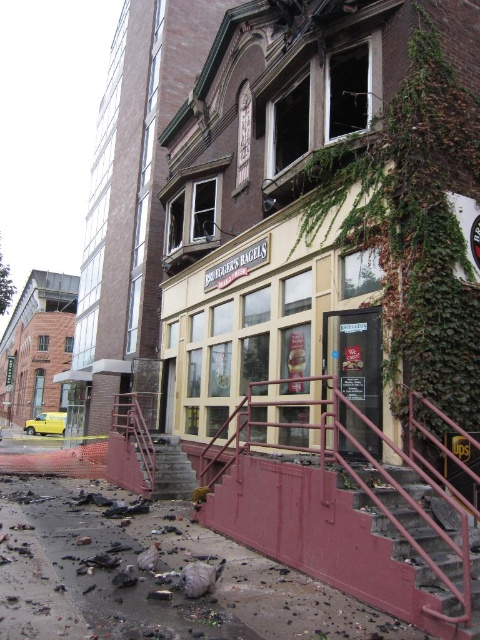
Is metallic red handrail at center shorter than rusty metal stairs at lower right?

In fact, metallic red handrail at center may be taller than rusty metal stairs at lower right.

Can you confirm if metallic red handrail at center is positioned to the right of rusty metal stairs at lower right?

No, metallic red handrail at center is not to the right of rusty metal stairs at lower right.

Locate an element on the screen. This screenshot has height=640, width=480. metallic red handrail at center is located at coordinates (350, 515).

Does metallic red handrail at center appear on the left side of concrete stairs at lower center?

In fact, metallic red handrail at center is to the right of concrete stairs at lower center.

Can you confirm if metallic red handrail at center is positioned above concrete stairs at lower center?

Indeed, metallic red handrail at center is positioned over concrete stairs at lower center.

Measure the distance between metallic red handrail at center and camera.

4.86 meters

This screenshot has width=480, height=640. Identify the location of metallic red handrail at center. (350, 515).

Between green ivy at upper right and rusty metal stairs at lower right, which one has more height?

With more height is green ivy at upper right.

Which is behind, point (360, 156) or point (432, 493)?

The point (360, 156) is behind.

Does point (420, 342) come closer to viewer compared to point (398, 508)?

No, (420, 342) is further to viewer.

I want to click on green ivy at upper right, so click(x=414, y=227).